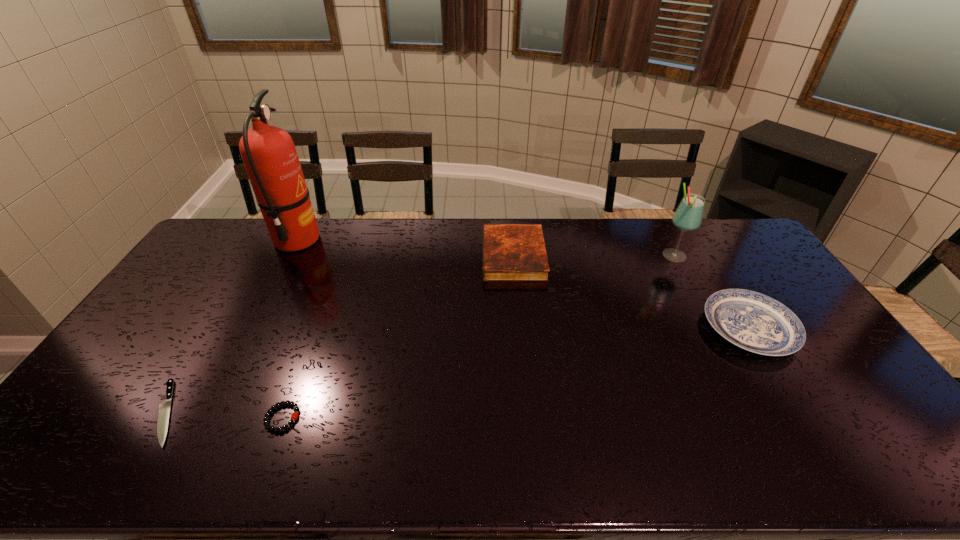
This screenshot has height=540, width=960. In order to click on free space at the far edge of the desktop in this screenshot , I will do `click(429, 217)`.

In the image, there is a desktop. At what (x,y) coordinates should I click in order to perform the action: click on free space at the left edge. Please return your answer as a coordinate pair (x, y). Image resolution: width=960 pixels, height=540 pixels. Looking at the image, I should click on (94, 392).

In order to click on vacant space at the right edge of the desktop in this screenshot , I will do tap(812, 346).

The image size is (960, 540). I want to click on blank region between the third object from right to left and the fire extinguisher, so click(x=405, y=248).

Where is `free spot between the second shortest object and the shortest object`? Image resolution: width=960 pixels, height=540 pixels. free spot between the second shortest object and the shortest object is located at coordinates (225, 415).

Where is `free spot between the steak knife and the alcohol`? free spot between the steak knife and the alcohol is located at coordinates (420, 335).

Where is `free space between the tallest object and the shortest object`? Image resolution: width=960 pixels, height=540 pixels. free space between the tallest object and the shortest object is located at coordinates (231, 327).

The width and height of the screenshot is (960, 540). In order to click on vacant region between the second tallest object and the third nearest object in this screenshot , I will do pos(711,292).

The image size is (960, 540). I want to click on free spot between the fourth farthest object and the alcohol, so point(711,292).

This screenshot has width=960, height=540. Find the location of `vacant space that is in between the fourth object from right to left and the shortest object`. vacant space that is in between the fourth object from right to left and the shortest object is located at coordinates (225, 415).